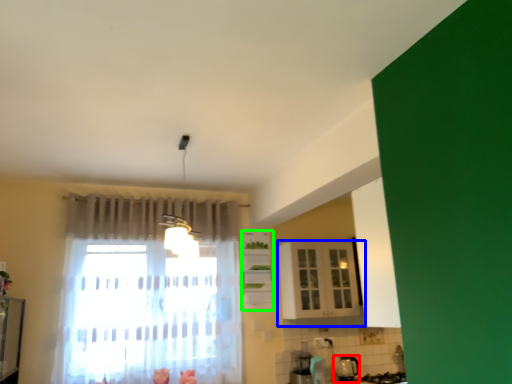
Question: Which object is the closest to the appliance (highlighted by a red box)? Choose among these: cabinetry (highlighted by a blue box) or cabinetry (highlighted by a green box).

Choices:
 (A) cabinetry
 (B) cabinetry

Answer: (A)